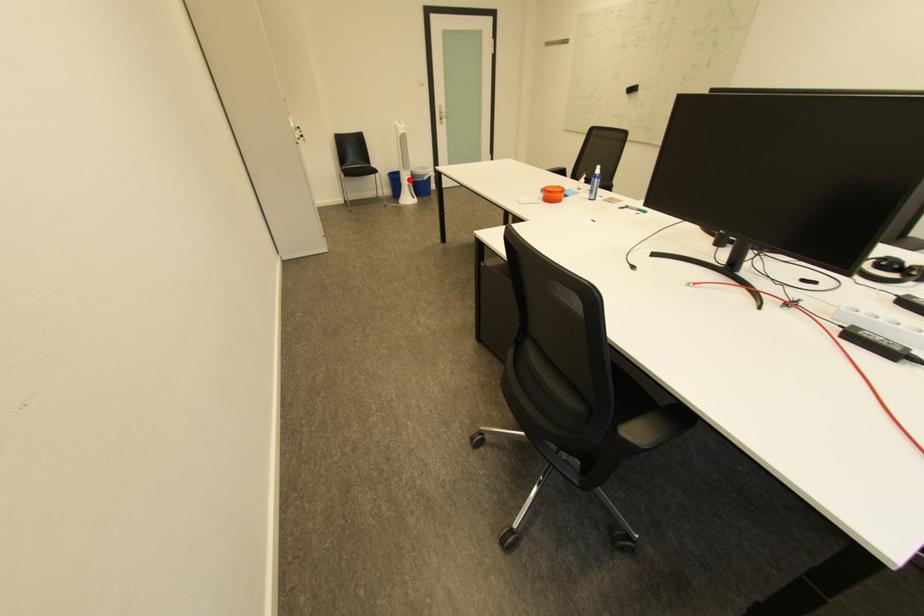
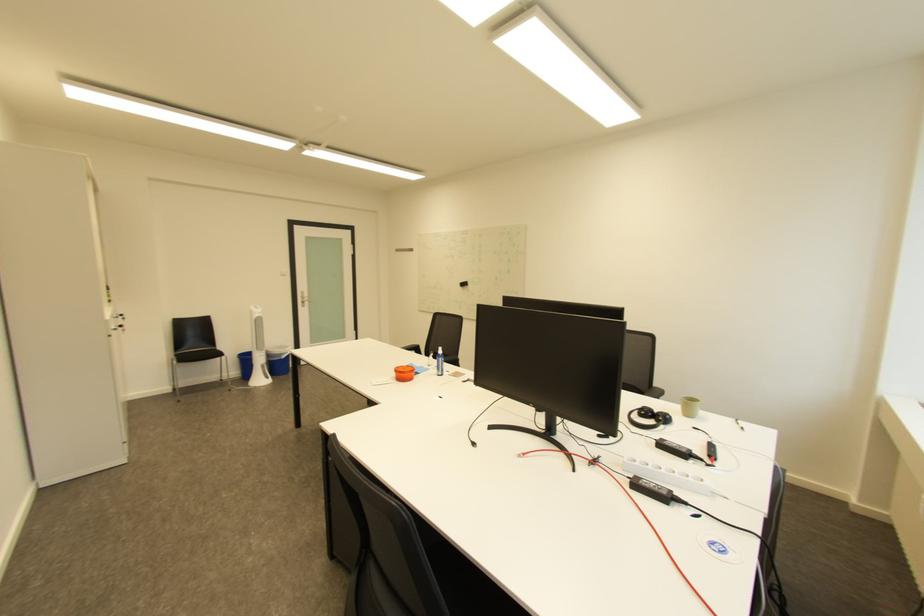
Question: I am providing you with two images of the same scene from different viewpoints. Given a red point in image1, look at the same physical point in image2. Is it:

Choices:
 (A) Closer to the viewpoint
 (B) Farther from the viewpoint

Answer: (B)